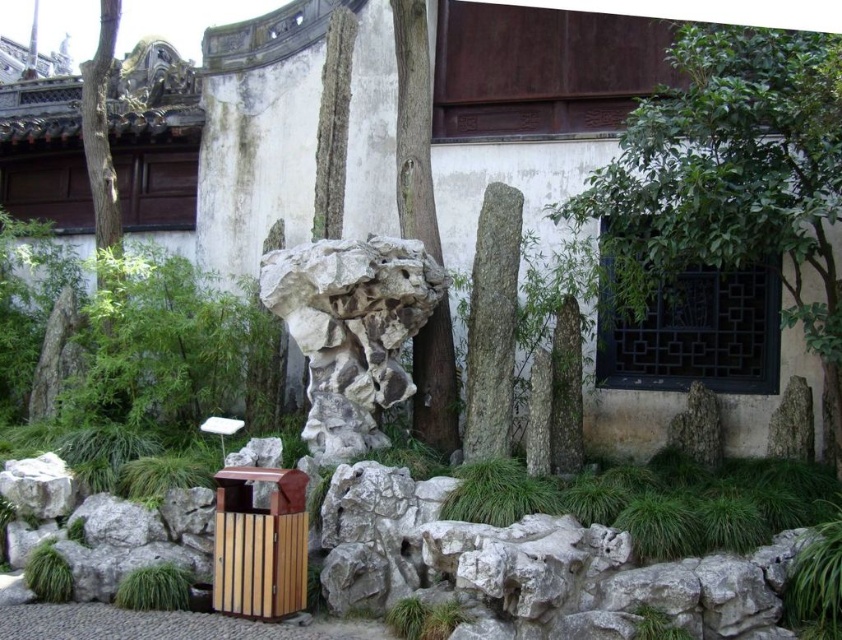
Who is lower down, white stone rock at center or smooth brown tree trunk at center?

white stone rock at center

Does white stone rock at center have a lesser width compared to smooth brown tree trunk at center?

Yes, white stone rock at center is thinner than smooth brown tree trunk at center.

Who is more distant from viewer, (x=324, y=340) or (x=429, y=202)?

The point (x=429, y=202) is more distant.

Image resolution: width=842 pixels, height=640 pixels. In order to click on white stone rock at center in this screenshot , I will do `click(350, 330)`.

Which is behind, point (686, 220) or point (454, 435)?

Point (454, 435)

Who is taller, green leafy tree at center or smooth brown tree trunk at center?

With more height is smooth brown tree trunk at center.

I want to click on green leafy tree at center, so click(x=733, y=177).

Find the location of a particular element. green leafy tree at center is located at coordinates (733, 177).

Does green leafy tree at center have a lesser width compared to white stone rock at center?

No, green leafy tree at center is not thinner than white stone rock at center.

Which is behind, point (633, 307) or point (440, 300)?

Positioned behind is point (440, 300).

You are a GUI agent. You are given a task and a screenshot of the screen. Output one action in this format:
    pyautogui.click(x=<x>, y=<y>)
    Task: Click on the green leafy tree at center
    Image resolution: width=842 pixels, height=640 pixels.
    Given the screenshot: What is the action you would take?
    pyautogui.click(x=733, y=177)

Locate an element on the screen. The height and width of the screenshot is (640, 842). green leafy tree at center is located at coordinates (733, 177).